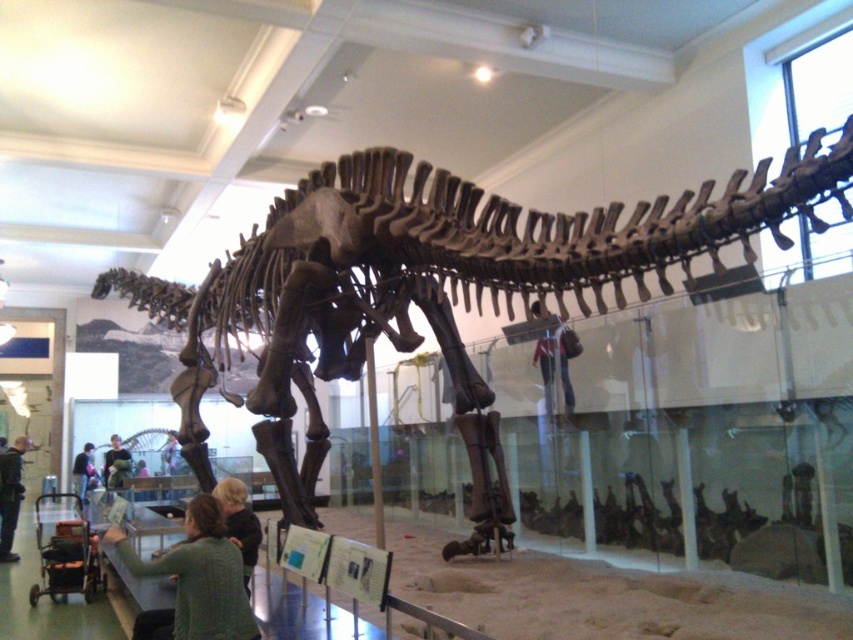
From the picture: Does dark brown leather jacket at lower left have a greater height compared to dark green sweater at lower left?

Yes, dark brown leather jacket at lower left is taller than dark green sweater at lower left.

Is dark brown leather jacket at lower left above dark green sweater at lower left?

Yes, dark brown leather jacket at lower left is above dark green sweater at lower left.

Measure the distance between dark brown leather jacket at lower left and camera.

8.87 meters

Where is `dark brown leather jacket at lower left`? The width and height of the screenshot is (853, 640). dark brown leather jacket at lower left is located at coordinates (10, 496).

Between green sweater at lower left and green fabric shirt at lower left, which one has less height?

With less height is green fabric shirt at lower left.

Does green sweater at lower left have a lesser width compared to green fabric shirt at lower left?

No.

Which is in front, point (183, 573) or point (93, 472)?

Point (183, 573)

In order to click on green sweater at lower left in this screenshot , I will do `click(195, 579)`.

Is dark brown leather jacket at lower left bigger than green fabric shirt at lower left?

No, dark brown leather jacket at lower left is not bigger than green fabric shirt at lower left.

Is point (10, 499) behind point (90, 456)?

No, (10, 499) is closer to viewer.

Who is more distant from viewer, (x=20, y=445) or (x=86, y=476)?

The point (x=86, y=476) is more distant.

Identify the location of dark brown leather jacket at lower left. The height and width of the screenshot is (640, 853). (10, 496).